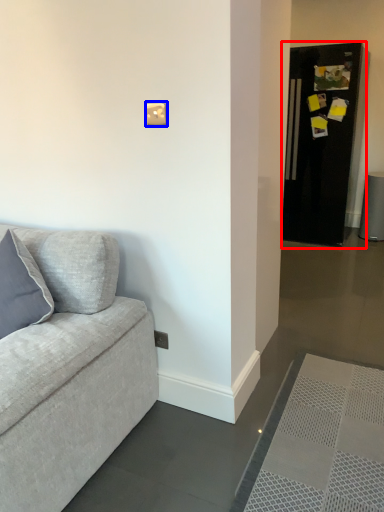
Question: Among these objects, which one is nearest to the camera, fridge (highlighted by a red box) or light switch (highlighted by a blue box)?

Choices:
 (A) fridge
 (B) light switch

Answer: (B)